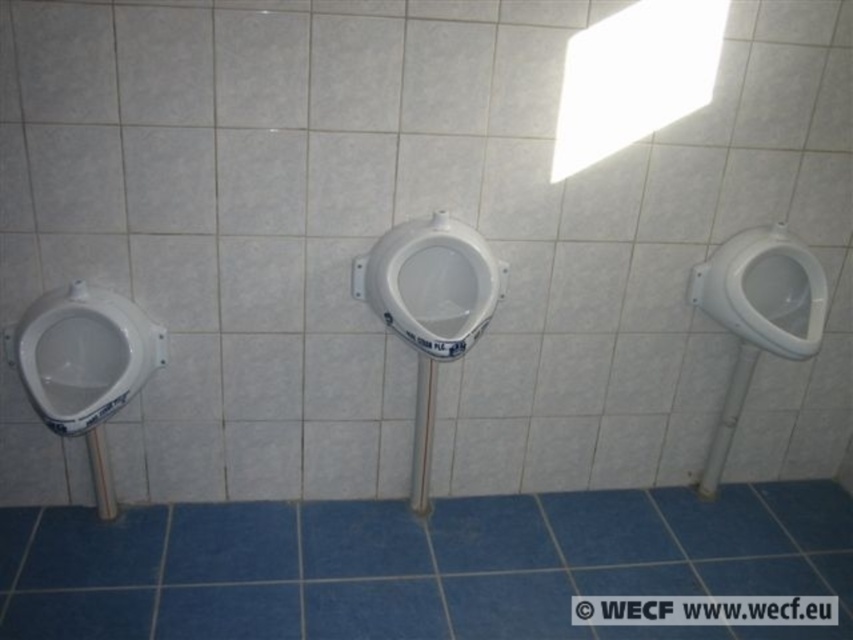
Between white glossy toilet bowl at left and white glossy urinal at right, which one is positioned lower?

white glossy toilet bowl at left is lower down.

Can you confirm if white glossy toilet bowl at left is thinner than white glossy urinal at right?

Incorrect, white glossy toilet bowl at left's width is not less than white glossy urinal at right's.

Where is `white glossy toilet bowl at left`? The height and width of the screenshot is (640, 853). white glossy toilet bowl at left is located at coordinates (83, 355).

Does white glossy toilet bowl at center appear over white glossy urinal at right?

Yes, white glossy toilet bowl at center is above white glossy urinal at right.

Is white glossy toilet bowl at center positioned behind white glossy urinal at right?

No, it is not.

You are a GUI agent. You are given a task and a screenshot of the screen. Output one action in this format:
    pyautogui.click(x=<x>, y=<y>)
    Task: Click on the white glossy toilet bowl at center
    Image resolution: width=853 pixels, height=640 pixels.
    Given the screenshot: What is the action you would take?
    431,284

Is white glossy toilet bowl at left taller than white glossy toilet bowl at center?

Incorrect, white glossy toilet bowl at left's height is not larger of white glossy toilet bowl at center's.

Is white glossy toilet bowl at left behind white glossy toilet bowl at center?

No, white glossy toilet bowl at left is closer to the viewer.

Is point (83, 324) closer to camera compared to point (503, 292)?

Yes, point (83, 324) is closer to viewer.

Identify the location of white glossy toilet bowl at left. This screenshot has height=640, width=853. (83, 355).